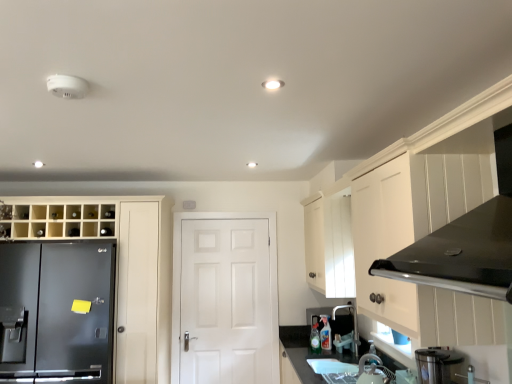
Question: Looking at the image, does smooth granite countertop at lower center seem bigger or smaller compared to clear plastic bottle at lower center?

Choices:
 (A) small
 (B) big

Answer: (B)

Question: In terms of height, does smooth granite countertop at lower center look taller or shorter compared to clear plastic bottle at lower center?

Choices:
 (A) tall
 (B) short

Answer: (A)

Question: Which of these objects is positioned farthest from the white glossy sink at lower center?

Choices:
 (A) metallic silver faucet at lower right, which is the second appliance in top-to-bottom order
 (B) stainless steel blender at lower right, the first appliance from the front
 (C) smooth granite countertop at lower center
 (D) matte silver faucet at lower center
 (E) matte black refrigerator at left

Answer: (E)

Question: Estimate the real-world distances between objects in this image. Which object is farther from the stainless steel blender at lower right, the second appliance when ordered from bottom to top?

Choices:
 (A) white matte door at center
 (B) smooth granite countertop at lower center
 (C) metallic silver faucet at lower right, which is the second appliance in top-to-bottom order
 (D) matte black refrigerator at left
 (E) matte silver faucet at lower center

Answer: (A)